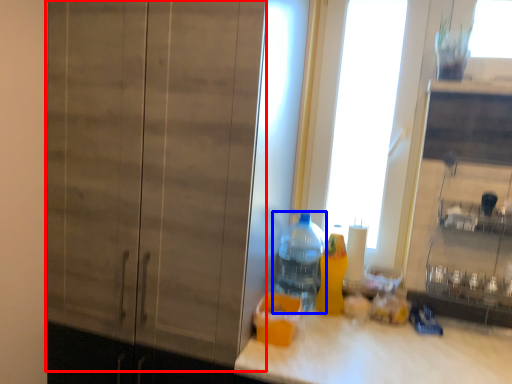
Question: Which point is further to the camera, barn door (highlighted by a red box) or bottle (highlighted by a blue box)?

Choices:
 (A) barn door
 (B) bottle

Answer: (B)